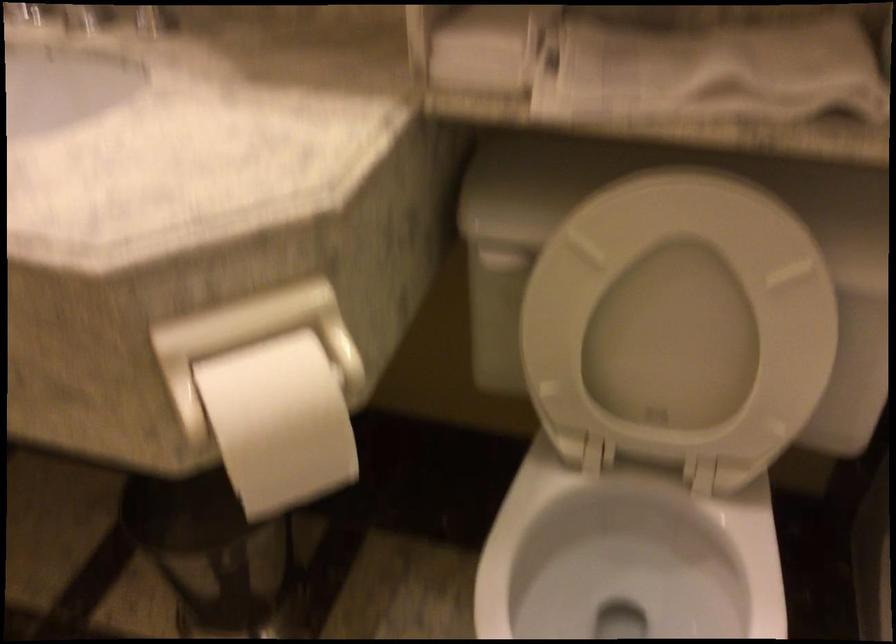
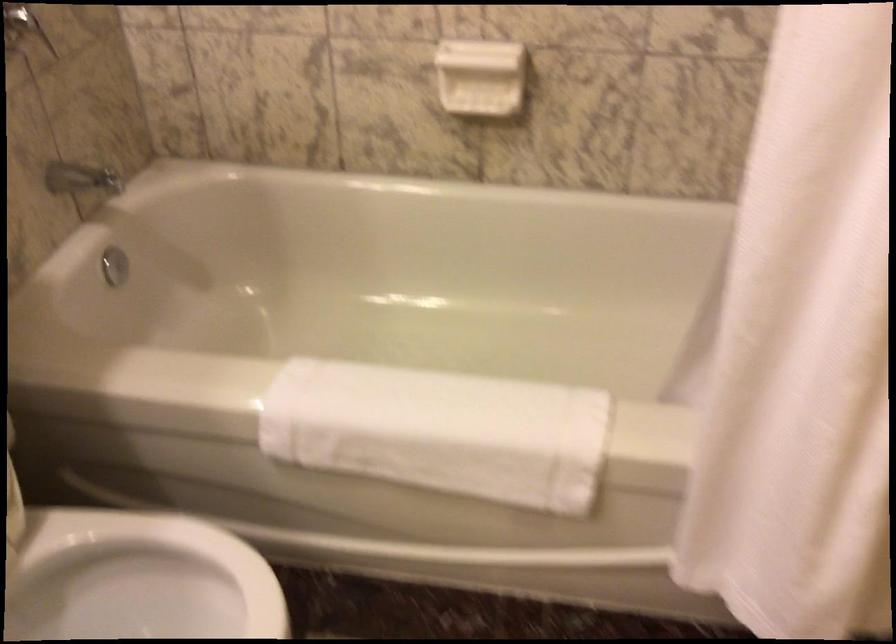
How did the camera likely rotate?

The camera rotated toward right-down.